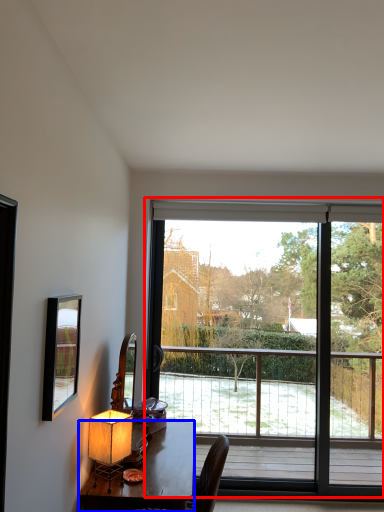
Question: Which object is closer to the camera taking this photo, window (highlighted by a red box) or desk (highlighted by a blue box)?

Choices:
 (A) window
 (B) desk

Answer: (B)